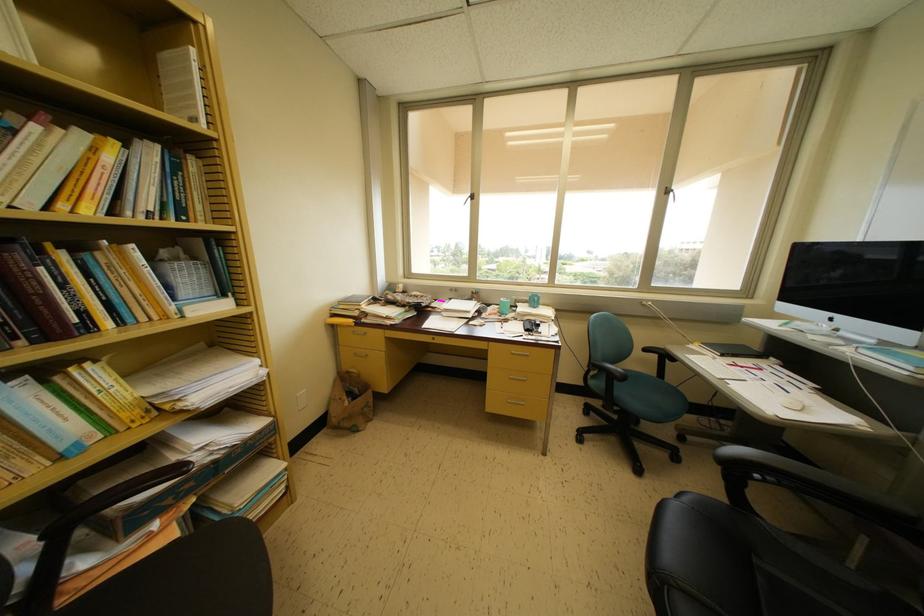
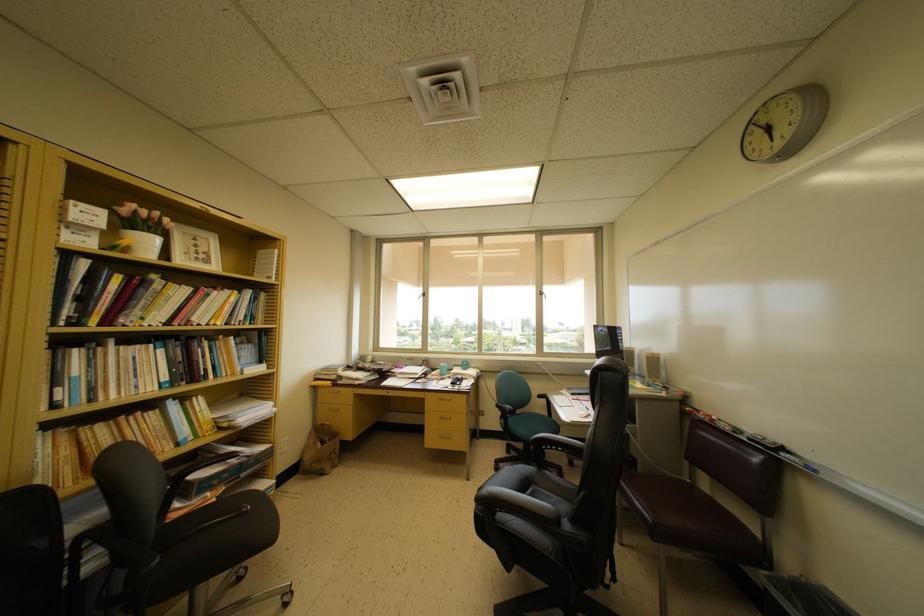
Question: The first image is from the beginning of the video and the second image is from the end. How did the camera likely rotate when shooting the video?

Choices:
 (A) Left
 (B) Right
 (C) Up
 (D) Down

Answer: (C)